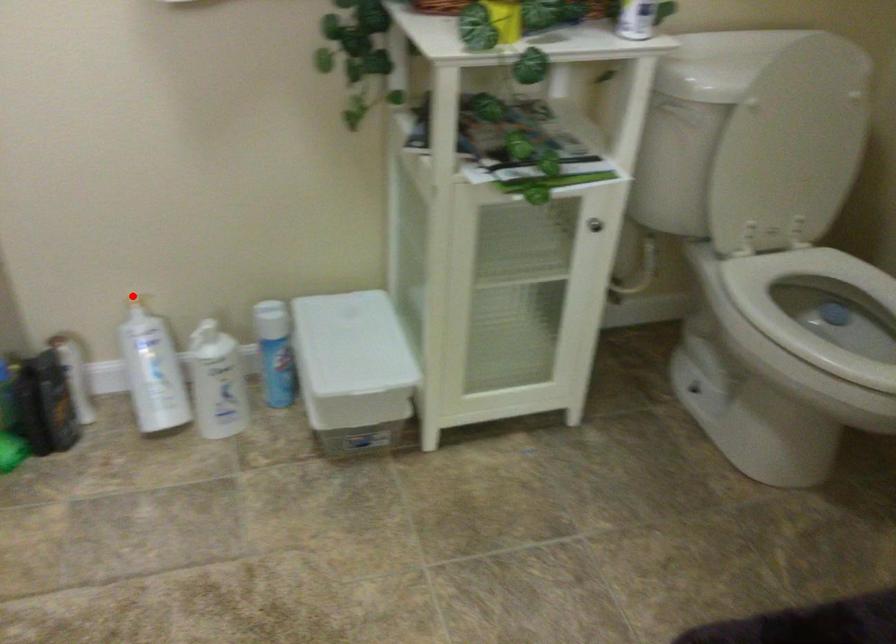
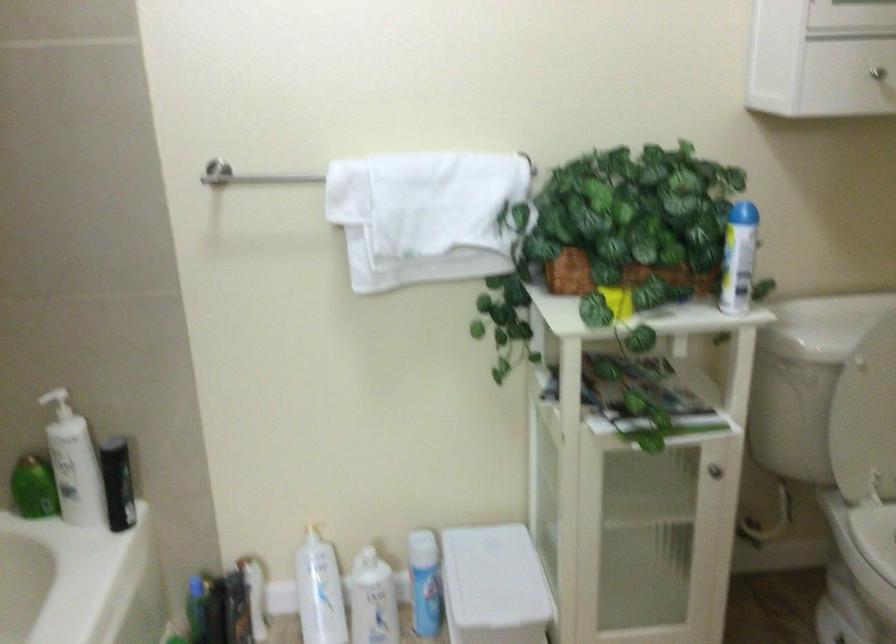
Question: I am providing you with two images of the same scene from different viewpoints. A red point is shown in image1. For the corresponding object point in image2, is it positioned nearer or farther from the camera?

Choices:
 (A) Nearer
 (B) Farther

Answer: (B)